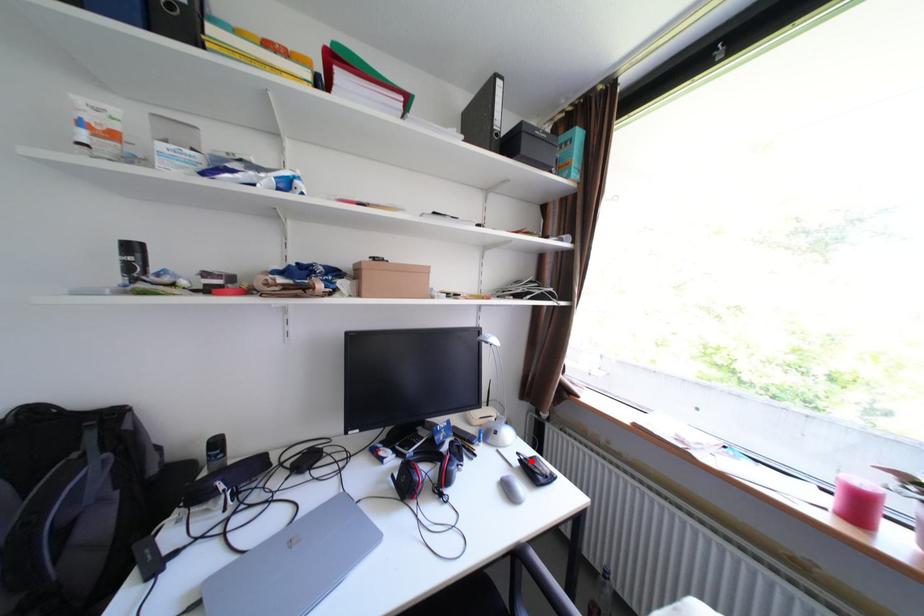
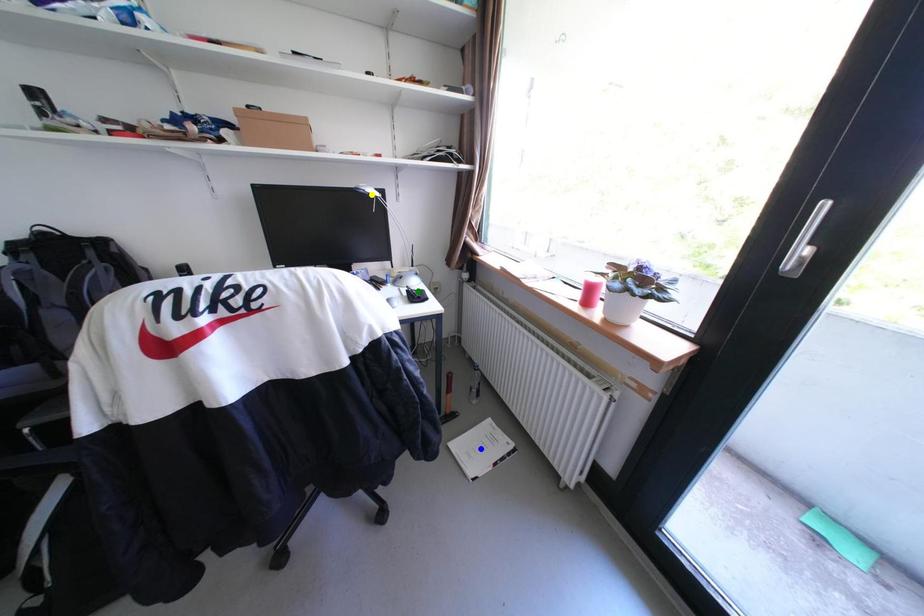
Question: I am providing you with two images of the same scene from different viewpoints. A red point is marked on the first image. You are given multiple points on the second image. Which point in image 2 represents the same 3d spot as the red point in image 1?

Choices:
 (A) green point
 (B) blue point
 (C) yellow point

Answer: (A)